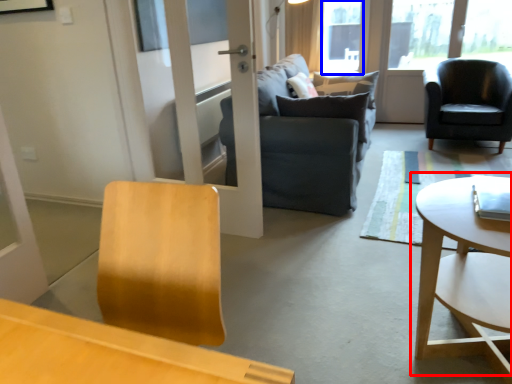
Question: Which object is further to the camera taking this photo, coffee table (highlighted by a red box) or window screen (highlighted by a blue box)?

Choices:
 (A) coffee table
 (B) window screen

Answer: (B)